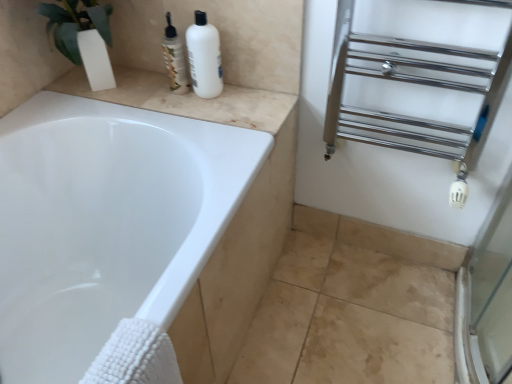
Image resolution: width=512 pixels, height=384 pixels. I want to click on vacant area in front of white matte bottle at upper center, so click(214, 111).